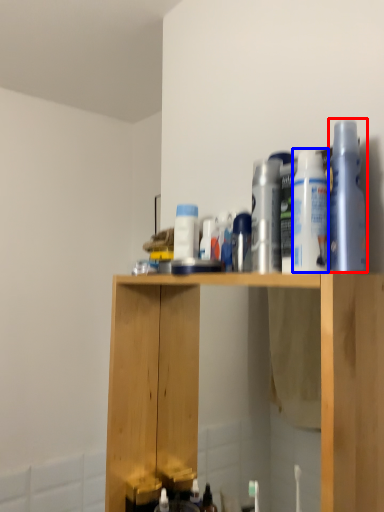
Question: Which point is further to the camera, cleaning product (highlighted by a red box) or cleaning product (highlighted by a blue box)?

Choices:
 (A) cleaning product
 (B) cleaning product

Answer: (B)